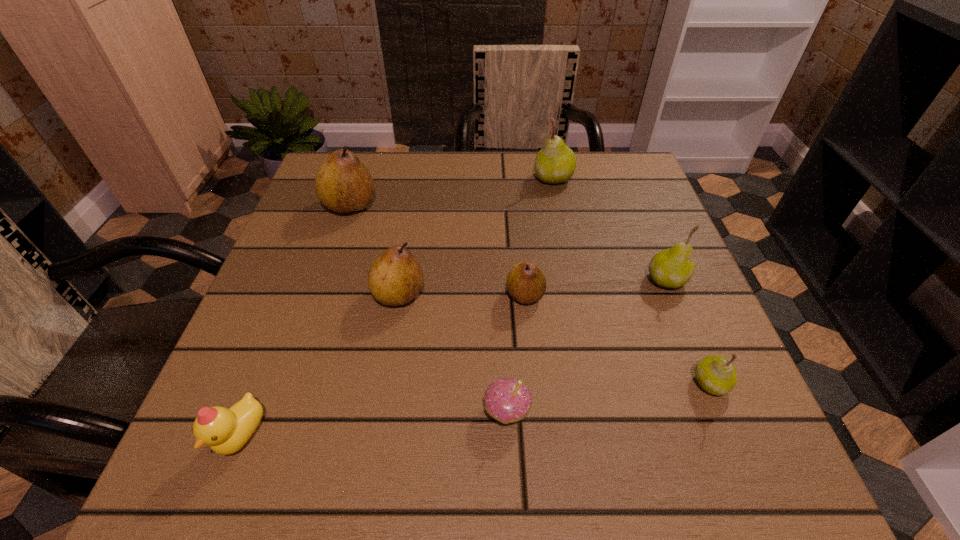
Where is `the second closest brown pear to the second biggest brown pear`? This screenshot has height=540, width=960. the second closest brown pear to the second biggest brown pear is located at coordinates pos(343,184).

Find the location of a particular element. free space that satisfies the following two spatial constraints: 1. on the back side of the cupcake; 2. on the left side of the third pear from right to left is located at coordinates (496, 178).

Where is `free space that satisfies the following two spatial constraints: 1. on the front side of the farthest brown pear; 2. on the left side of the pink cupcake`? The height and width of the screenshot is (540, 960). free space that satisfies the following two spatial constraints: 1. on the front side of the farthest brown pear; 2. on the left side of the pink cupcake is located at coordinates (280, 412).